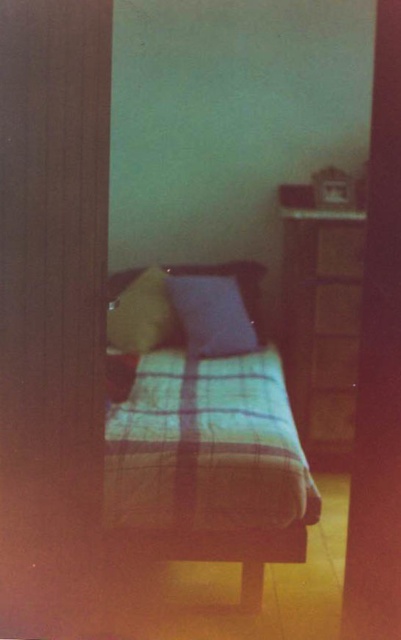
Which is below, wooden dresser at right or yellow fabric pillow at center?

wooden dresser at right is below.

Is wooden dresser at right closer to camera compared to yellow fabric pillow at center?

Yes, wooden dresser at right is in front of yellow fabric pillow at center.

Is point (299, 184) farther from camera compared to point (111, 307)?

No.

The width and height of the screenshot is (401, 640). I want to click on wooden dresser at right, so click(320, 320).

Is plaid fabric bed at center smaller than wooden dresser at right?

No, plaid fabric bed at center is not smaller than wooden dresser at right.

Who is positioned more to the right, plaid fabric bed at center or wooden dresser at right?

From the viewer's perspective, wooden dresser at right appears more on the right side.

Does point (263, 480) come behind point (285, 314)?

Yes, point (263, 480) is behind point (285, 314).

Where is `plaid fabric bed at center`? The width and height of the screenshot is (401, 640). plaid fabric bed at center is located at coordinates [204, 429].

Does matte blue pillow at center appear under yellow fabric pillow at center?

Indeed, matte blue pillow at center is positioned under yellow fabric pillow at center.

Who is positioned more to the right, matte blue pillow at center or yellow fabric pillow at center?

matte blue pillow at center

This screenshot has height=640, width=401. What do you see at coordinates (212, 316) in the screenshot?
I see `matte blue pillow at center` at bounding box center [212, 316].

The image size is (401, 640). What are the coordinates of `matte blue pillow at center` in the screenshot? It's located at (212, 316).